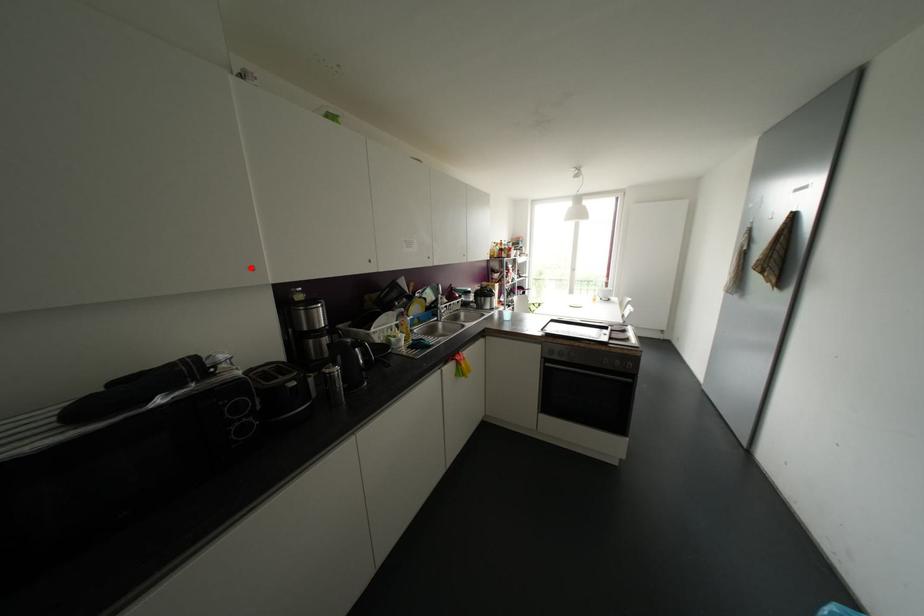
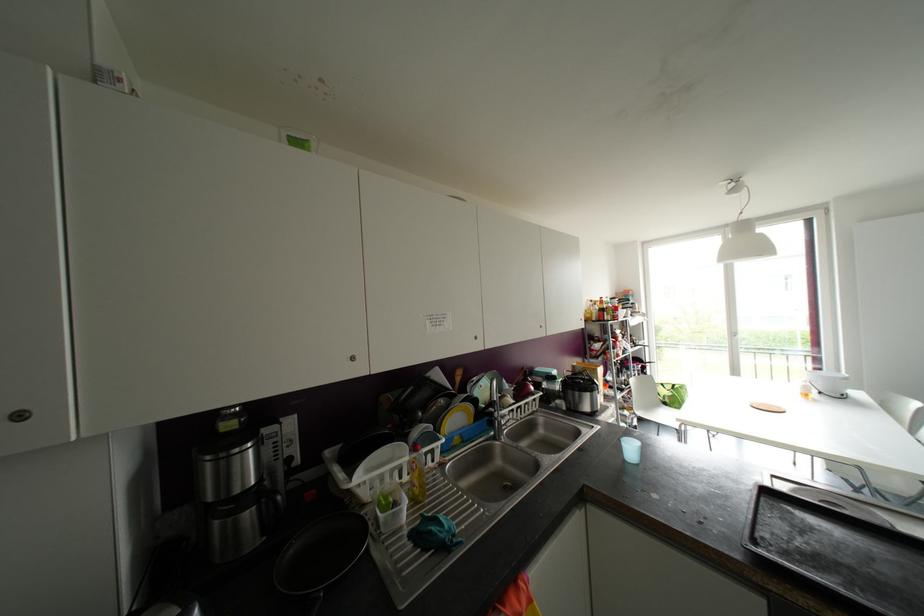
Find the pixel in the second image that matches the highlighted location in the first image.

(19, 416)